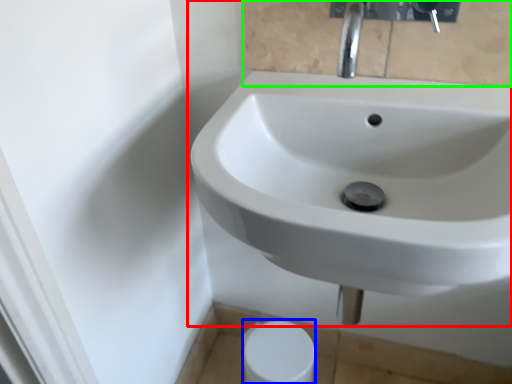
Question: Based on their relative distances, which object is nearer to sink (highlighted by a red box)? Choose from toilet paper (highlighted by a blue box) and mirror (highlighted by a green box).

Choices:
 (A) toilet paper
 (B) mirror

Answer: (B)